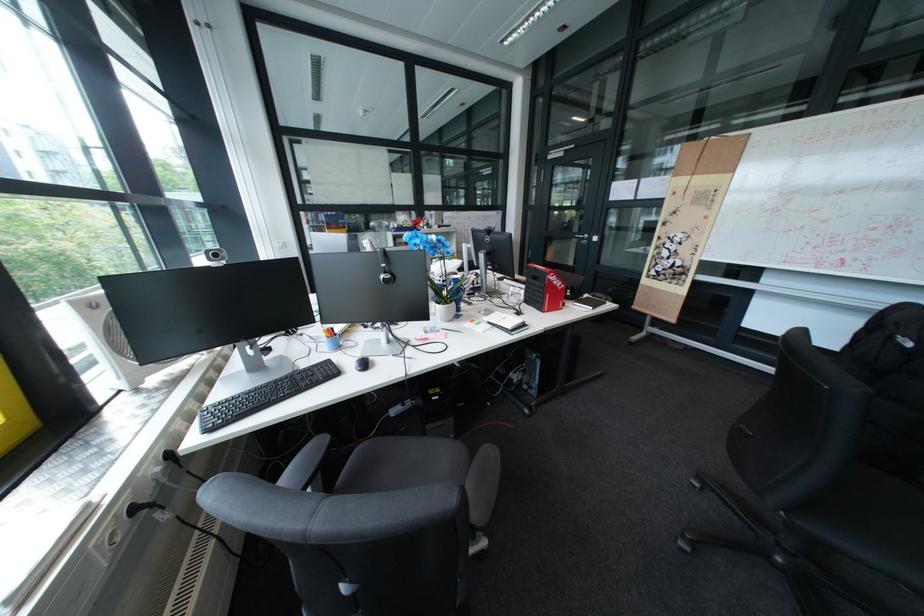
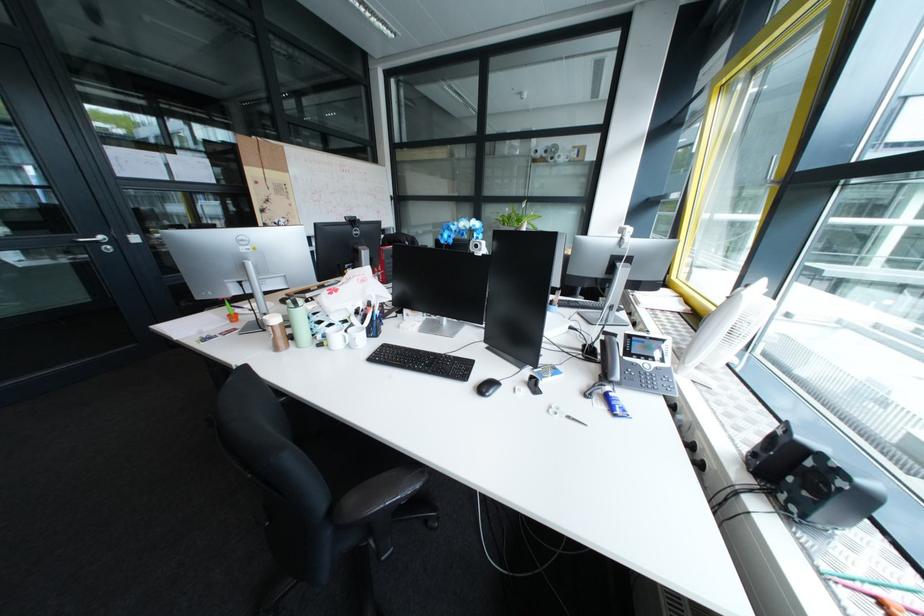
Question: I am providing you with two images of the same scene from different viewpoints. Which of the following objects are not visible in image2?

Choices:
 (A) small black notebook
 (B) blue cream tube
 (C) white mug handle
 (D) pink thermos

Answer: (A)